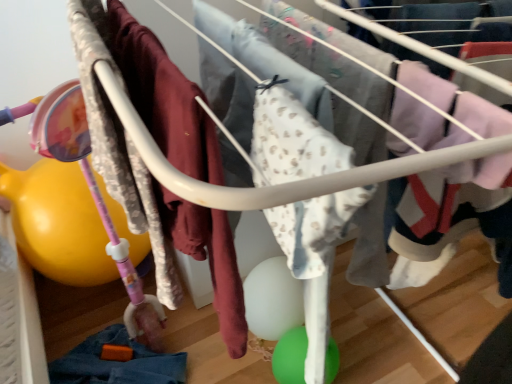
What do you see at coordinates (290, 356) in the screenshot? Image resolution: width=512 pixels, height=384 pixels. I see `green rubber balloon at lower center` at bounding box center [290, 356].

Identify the location of green rubber balloon at lower center. (290, 356).

The width and height of the screenshot is (512, 384). In order to click on green rubber balloon at lower center in this screenshot , I will do `click(290, 356)`.